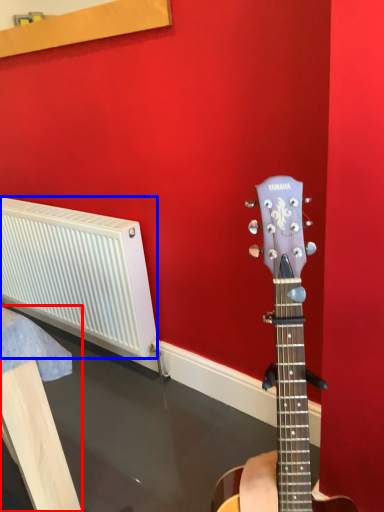
Question: Which of the following is the closest to the observer, furniture (highlighted by a red box) or radiator (highlighted by a blue box)?

Choices:
 (A) furniture
 (B) radiator

Answer: (A)